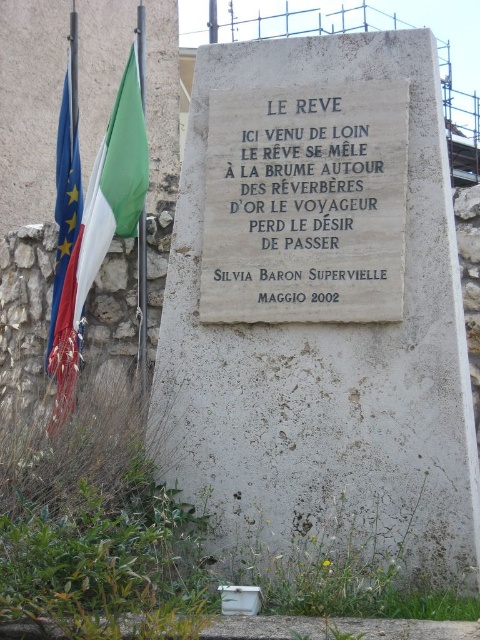
You are a tourist visiting a historical site and see the black stone plaque at center and the european union flag at left. Which object is closer to you based on their positions?

The black stone plaque at center is closer to you because it is in front of the european union flag at left.

You are standing in front of the stone monument and want to take a photo of the engraved plaque. The camera you are using has a maximum focus range of 20 meters. Will the point at coordinates point (120, 216) be within the camera focus range?

The point at coordinates point (120, 216) is 19.31 meters from the camera, which is within the maximum focus range of 20 meters. Therefore, the camera can focus on that point.

You are standing in front of the stone monument with the engraved plaque. There is a green fabric flag at left. Where is the green fabric flag located relative to the monument?

The green fabric flag at left is located at the left side of the monument, specifically at the 2D coordinates point of (x=113, y=182).